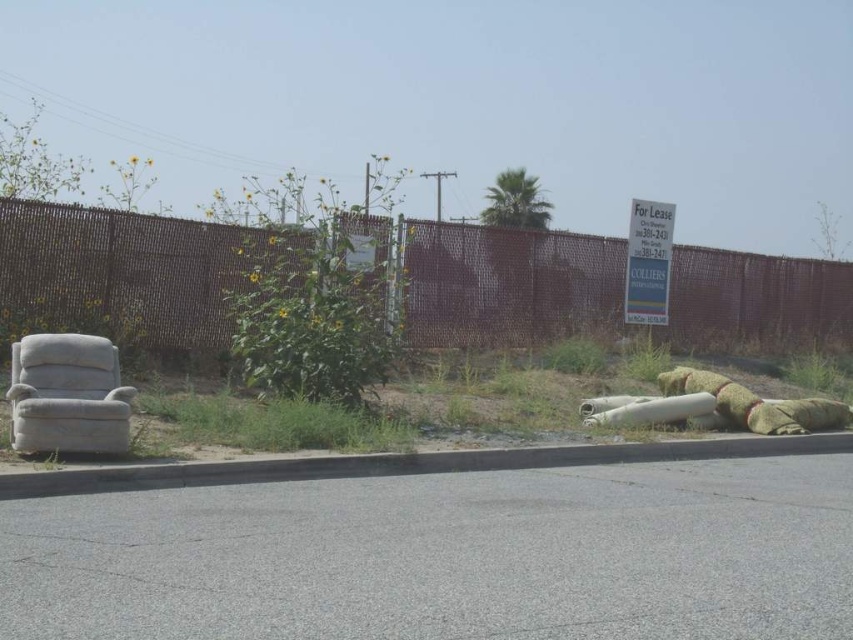
Question: Can you confirm if gray asphalt curb at lower left is positioned to the left of white fabric armchair at left?

Choices:
 (A) yes
 (B) no

Answer: (B)

Question: In this image, where is brown mesh fence at center located relative to white fabric armchair at left?

Choices:
 (A) above
 (B) below

Answer: (A)

Question: Based on their relative distances, which object is nearer to the brown mesh fence at center?

Choices:
 (A) gray asphalt curb at lower left
 (B) white fabric armchair at left

Answer: (B)

Question: Among these points, which one is nearest to the camera?

Choices:
 (A) (167, 465)
 (B) (482, 262)
 (C) (16, 355)

Answer: (A)

Question: Which point is farther to the camera?

Choices:
 (A) (531, 467)
 (B) (85, 291)
 (C) (36, 378)

Answer: (B)

Question: Is brown mesh fence at center bigger than gray asphalt curb at lower left?

Choices:
 (A) yes
 (B) no

Answer: (A)